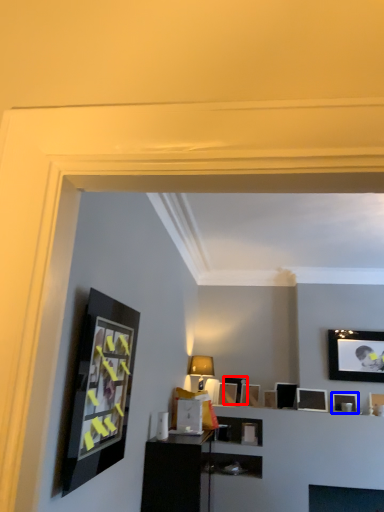
Question: Among these objects, which one is nearest to the camera, picture frame (highlighted by a red box) or picture frame (highlighted by a blue box)?

Choices:
 (A) picture frame
 (B) picture frame

Answer: (B)